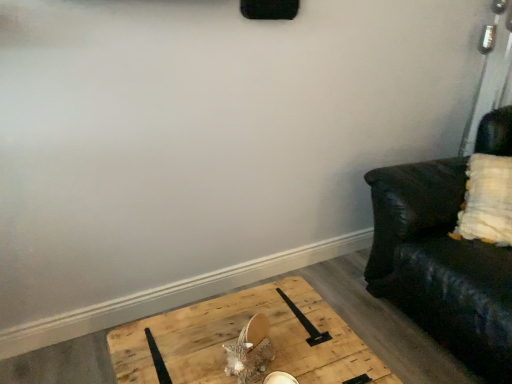
Question: Is the position of black leather couch at right more distant than that of wooden pallet at lower center?

Choices:
 (A) no
 (B) yes

Answer: (B)

Question: Does black leather couch at right have a greater width compared to wooden pallet at lower center?

Choices:
 (A) no
 (B) yes

Answer: (B)

Question: Is black leather couch at right far away from wooden pallet at lower center?

Choices:
 (A) no
 (B) yes

Answer: (A)

Question: Is black leather couch at right turned away from wooden pallet at lower center?

Choices:
 (A) yes
 (B) no

Answer: (B)

Question: Is wooden pallet at lower center surrounded by black leather couch at right?

Choices:
 (A) no
 (B) yes

Answer: (A)

Question: Is black leather couch at right smaller than wooden pallet at lower center?

Choices:
 (A) yes
 (B) no

Answer: (B)

Question: Is wooden pallet at lower center turned away from black leather couch at right?

Choices:
 (A) no
 (B) yes

Answer: (A)

Question: From the image's perspective, is wooden pallet at lower center under black leather couch at right?

Choices:
 (A) no
 (B) yes

Answer: (B)

Question: Does wooden pallet at lower center have a lesser height compared to black leather couch at right?

Choices:
 (A) yes
 (B) no

Answer: (A)

Question: Is wooden pallet at lower center to the right of black leather couch at right from the viewer's perspective?

Choices:
 (A) no
 (B) yes

Answer: (A)

Question: Does wooden pallet at lower center have a greater height compared to black leather couch at right?

Choices:
 (A) yes
 (B) no

Answer: (B)

Question: Does wooden pallet at lower center have a greater width compared to black leather couch at right?

Choices:
 (A) no
 (B) yes

Answer: (A)

Question: From the image's perspective, is wooden pallet at lower center above or below black leather couch at right?

Choices:
 (A) above
 (B) below

Answer: (B)